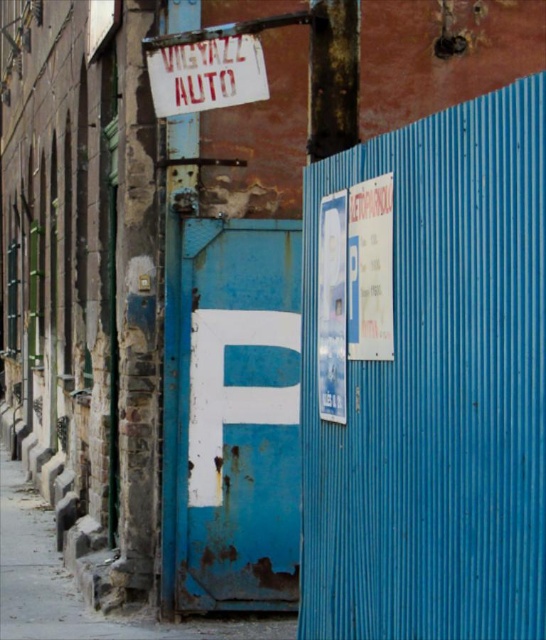
Between point (207, 512) and point (165, 60), which one is positioned in front?

Point (165, 60)

At what (x,y) coordinates should I click in order to perform the action: click on rusty metal letter at center. Please return your answer as a coordinate pair (x, y). This screenshot has height=640, width=546. Looking at the image, I should click on (232, 413).

I want to click on rusty metal letter at center, so click(232, 413).